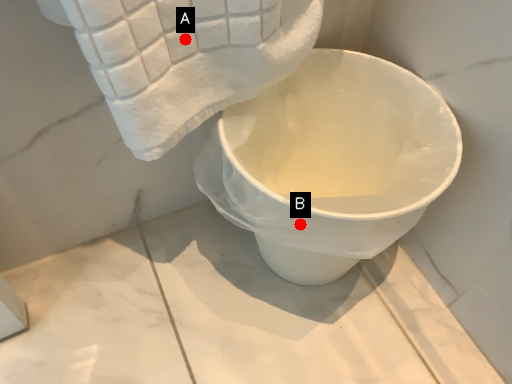
Question: Two points are circled on the image, labeled by A and B beside each circle. Among these points, which one is farthest from the camera?

Choices:
 (A) A is further
 (B) B is further

Answer: (B)